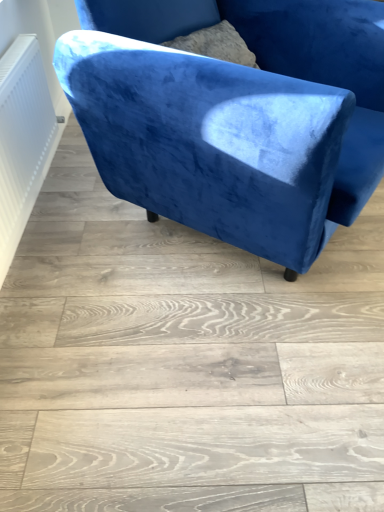
At what (x,y) coordinates should I click in order to perform the action: click on vacant space to the right of white textured radiator at left. Please return your answer as a coordinate pair (x, y). This screenshot has width=384, height=512. Looking at the image, I should click on (113, 219).